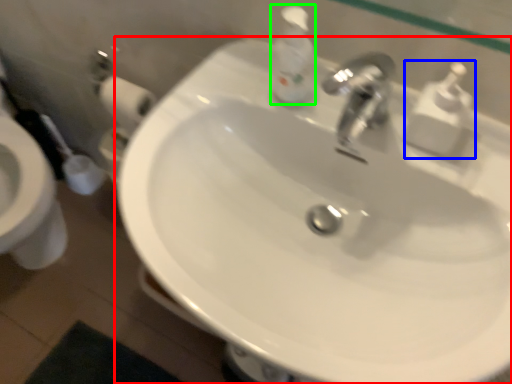
Question: Based on their relative distances, which object is farther from sink (highlighted by a red box)? Choose from soap dispenser (highlighted by a blue box) and soap dispenser (highlighted by a green box).

Choices:
 (A) soap dispenser
 (B) soap dispenser

Answer: (A)